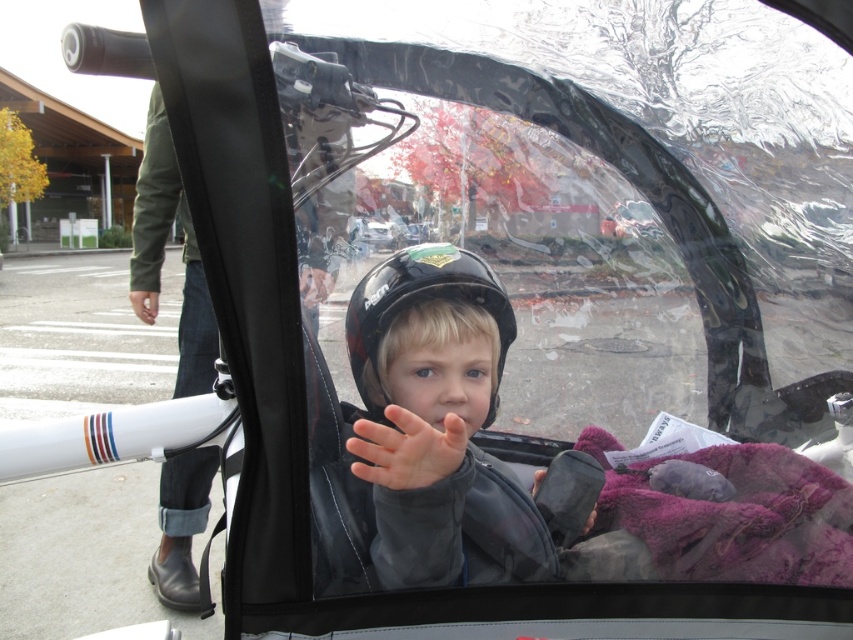
Question: Does black matte helmet at center have a larger size compared to black matte glove at center?

Choices:
 (A) yes
 (B) no

Answer: (A)

Question: Estimate the real-world distances between objects in this image. Which object is closer to the black leather boot at left?

Choices:
 (A) metallic silver car at center
 (B) black matte glove at center
 (C) smooth skin hand at center
 (D) matte black helmet at center

Answer: (D)

Question: Can you confirm if black leather boot at left is smaller than black matte helmet at center?

Choices:
 (A) yes
 (B) no

Answer: (B)

Question: Based on their relative distances, which object is nearer to the black matte helmet at center?

Choices:
 (A) black leather boot at left
 (B) matte black helmet at center

Answer: (B)

Question: Is matte black helmet at center positioned in front of black leather boot at left?

Choices:
 (A) yes
 (B) no

Answer: (A)

Question: Which object is the farthest from the matte black helmet at center?

Choices:
 (A) black leather boot at left
 (B) metallic silver car at center
 (C) black matte helmet at center
 (D) smooth skin hand at center

Answer: (B)